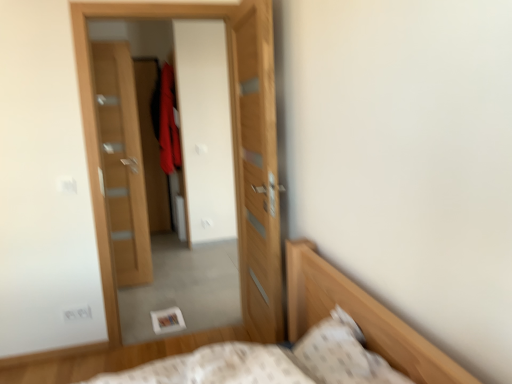
Question: From a real-world perspective, is wooden door at left, the third door in the right-to-left sequence, under velvet red robe at center?

Choices:
 (A) yes
 (B) no

Answer: (A)

Question: From a real-world perspective, is wooden door at left, the third door in the right-to-left sequence, on top of velvet red robe at center?

Choices:
 (A) no
 (B) yes

Answer: (A)

Question: Considering the relative sizes of wooden door at left, the third door in the right-to-left sequence, and velvet red robe at center in the image provided, is wooden door at left, the third door in the right-to-left sequence, wider than velvet red robe at center?

Choices:
 (A) no
 (B) yes

Answer: (A)

Question: Can you confirm if wooden door at left, the third door in the front-to-back sequence, is taller than velvet red robe at center?

Choices:
 (A) no
 (B) yes

Answer: (B)

Question: Does wooden door at left, which appears as the first door when viewed from the left, come behind velvet red robe at center?

Choices:
 (A) no
 (B) yes

Answer: (A)

Question: From their relative heights in the image, would you say wooden door at center, which ranks as the second door in back-to-front order, is taller or shorter than wooden door at center, acting as the third door starting from the left?

Choices:
 (A) tall
 (B) short

Answer: (A)

Question: Considering their positions, is wooden door at center, arranged as the 2th door when viewed from the left, located in front of or behind wooden door at center, which appears as the 1th door when viewed from the right?

Choices:
 (A) behind
 (B) front

Answer: (A)

Question: From the image's perspective, is wooden door at center, the 2th door when ordered from right to left, above or below wooden door at center, acting as the third door starting from the left?

Choices:
 (A) below
 (B) above

Answer: (B)

Question: From a real-world perspective, relative to wooden door at center, the 3th door when ordered from back to front, is wooden door at center, arranged as the 2th door when viewed from the left, vertically above or below?

Choices:
 (A) above
 (B) below

Answer: (A)

Question: Considering the positions of point (234, 6) and point (324, 324), is point (234, 6) closer or farther from the camera than point (324, 324)?

Choices:
 (A) closer
 (B) farther

Answer: (B)

Question: Looking at the image, does wooden door at center, which ranks as the second door in back-to-front order, seem bigger or smaller compared to white textured pillow at lower right?

Choices:
 (A) small
 (B) big

Answer: (B)

Question: In terms of width, does wooden door at center, arranged as the 2th door when viewed from the front, look wider or thinner when compared to white textured pillow at lower right?

Choices:
 (A) thin
 (B) wide

Answer: (A)

Question: From their relative heights in the image, would you say wooden door at center, which ranks as the second door in back-to-front order, is taller or shorter than white textured pillow at lower right?

Choices:
 (A) tall
 (B) short

Answer: (A)

Question: Is point (174, 94) closer or farther from the camera than point (331, 362)?

Choices:
 (A) farther
 (B) closer

Answer: (A)

Question: Considering their positions, is velvet red robe at center located in front of or behind white textured pillow at lower right?

Choices:
 (A) behind
 (B) front

Answer: (A)